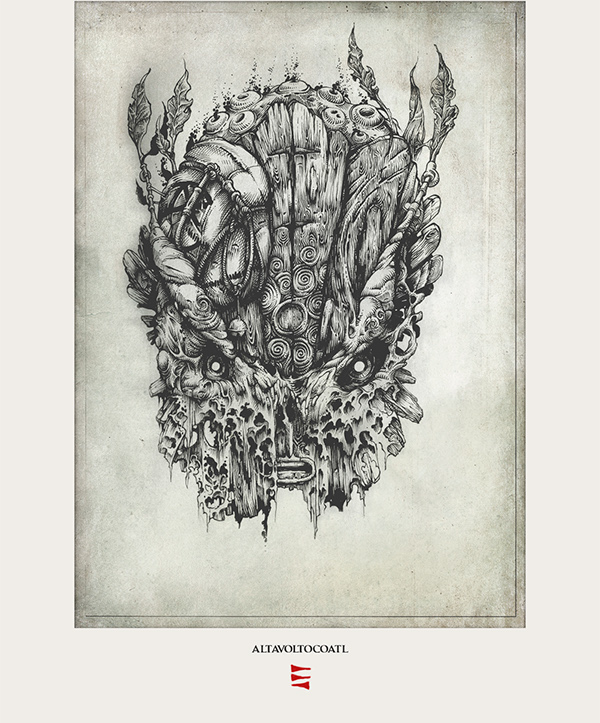
Find the location of a particular element. This screenshot has width=600, height=723. top right corner white photo mat is located at coordinates (598, 0).